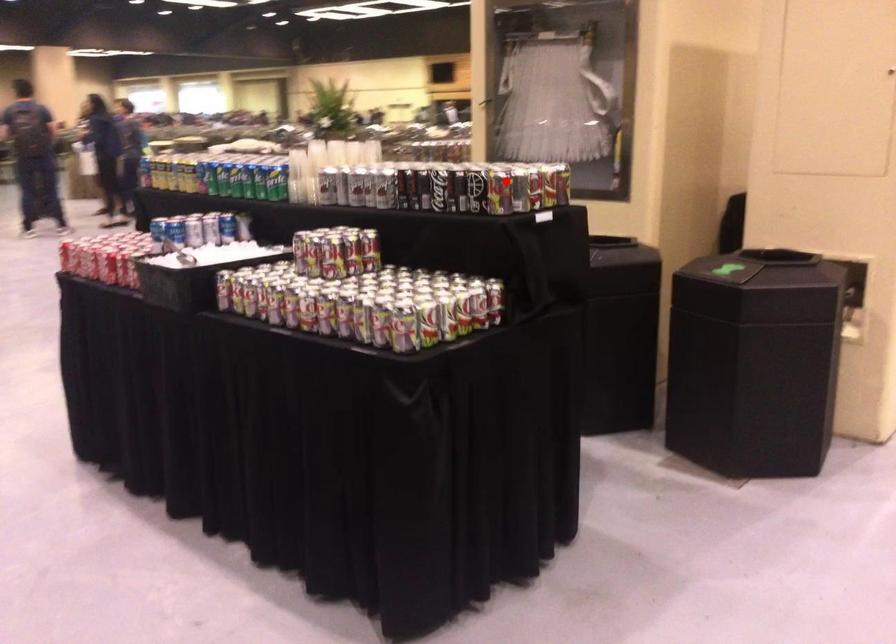
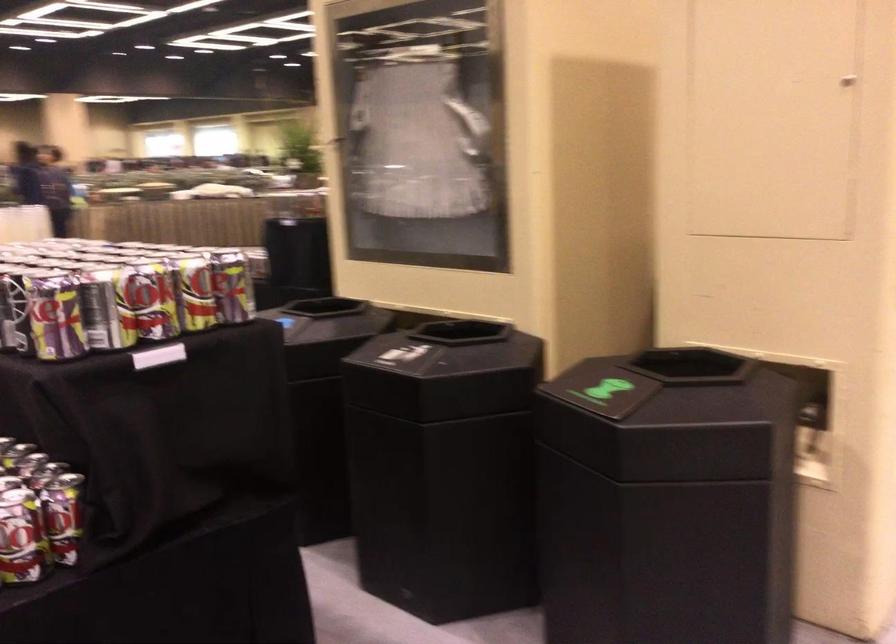
The point at the highlighted location is marked in the first image. Where is the corresponding point in the second image?

(55, 316)